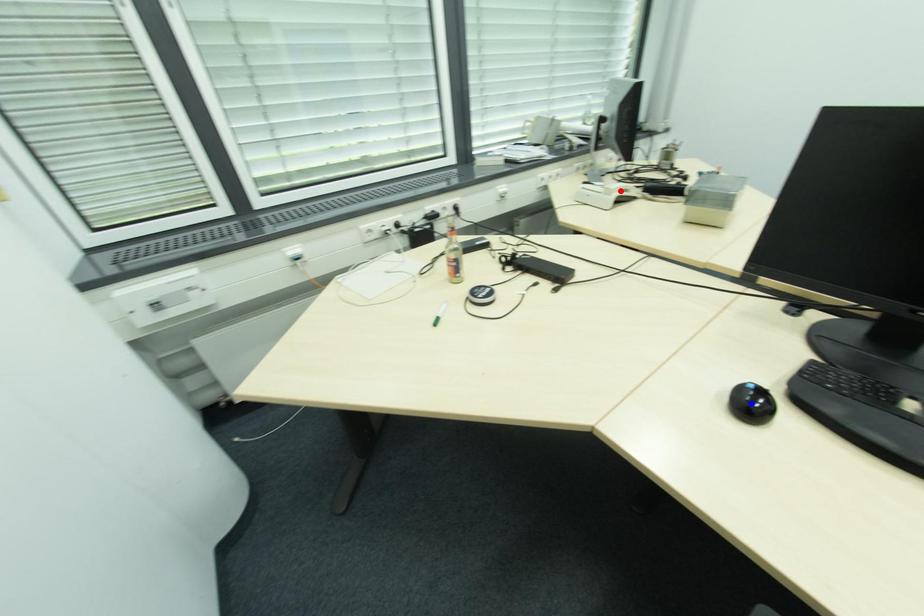
Question: In the image, two points are highlighted. Which point is nearer to the camera? Reply with the corresponding letter.

Choices:
 (A) blue point
 (B) red point

Answer: (A)